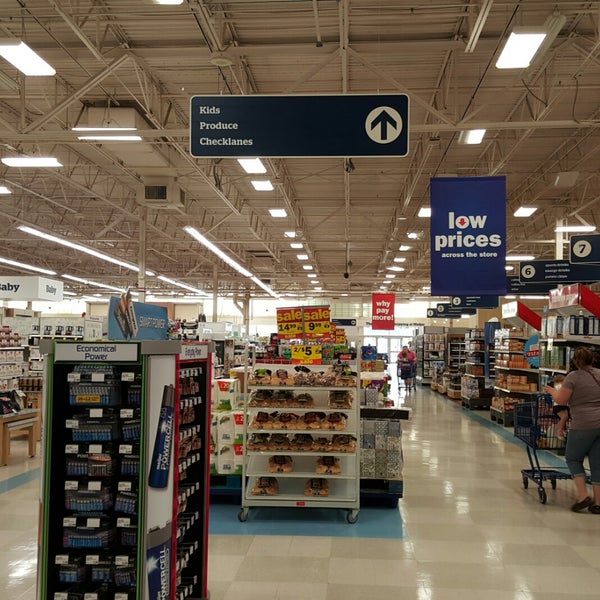
I want to click on empty spaces on shelf, so click(342, 487), click(289, 485), click(303, 465), click(260, 464), click(320, 400).